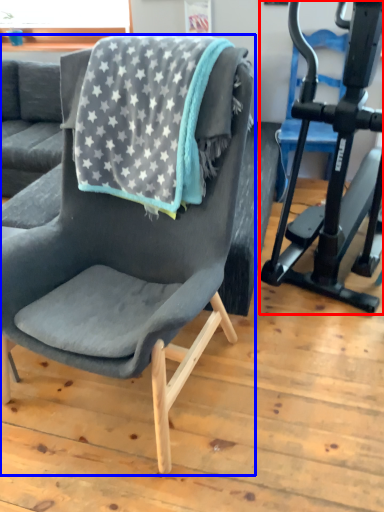
Question: Which object is closer to the camera taking this photo, stationary bicycle (highlighted by a red box) or chair (highlighted by a blue box)?

Choices:
 (A) stationary bicycle
 (B) chair

Answer: (B)